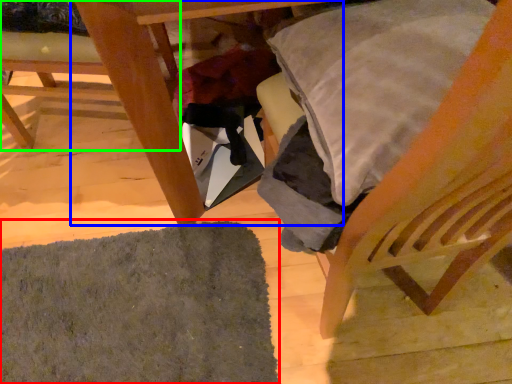
Question: Estimate the real-world distances between objects in this image. Which object is farther from mat (highlighted by a red box), table (highlighted by a blue box) or chair (highlighted by a green box)?

Choices:
 (A) table
 (B) chair

Answer: (B)